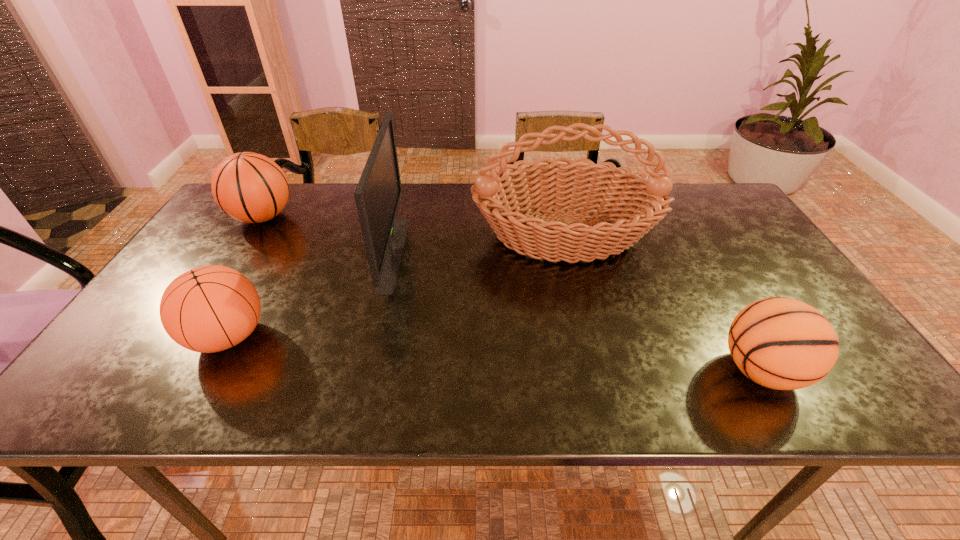
Locate an element on the screen. The width and height of the screenshot is (960, 540). basket is located at coordinates (545, 184).

Locate an element on the screen. the third object from right to left is located at coordinates (378, 193).

This screenshot has width=960, height=540. What are the coordinates of `the farthest basketball` in the screenshot? It's located at (249, 187).

Where is `the rightmost basketball`? the rightmost basketball is located at coordinates (781, 343).

At what (x,y) coordinates should I click in order to perform the action: click on free region located 0.280m on the right of the basket. Please return your answer as a coordinate pair (x, y). Looking at the image, I should click on (754, 235).

I want to click on free region located on the front-facing side of the monitor, so click(x=453, y=253).

The height and width of the screenshot is (540, 960). In order to click on vacant area located on the front of the farthest basketball in this screenshot , I will do `click(223, 279)`.

Find the location of `free location located 0.340m on the left of the rightmost basketball`. free location located 0.340m on the left of the rightmost basketball is located at coordinates (557, 370).

At what (x,y) coordinates should I click in order to perform the action: click on basket that is at the far edge. Please return your answer as a coordinate pair (x, y). The height and width of the screenshot is (540, 960). Looking at the image, I should click on (545, 184).

Find the location of a particular element. Image resolution: width=960 pixels, height=540 pixels. monitor present at the far edge is located at coordinates (378, 193).